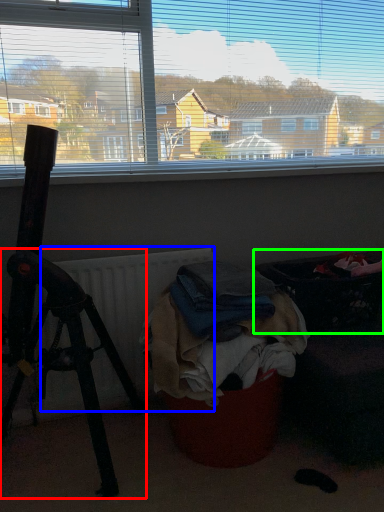
Question: Which object is the farthest from tripod (highlighted by a red box)? Choose among these: radiator (highlighted by a blue box) or laundry basket (highlighted by a green box).

Choices:
 (A) radiator
 (B) laundry basket

Answer: (B)